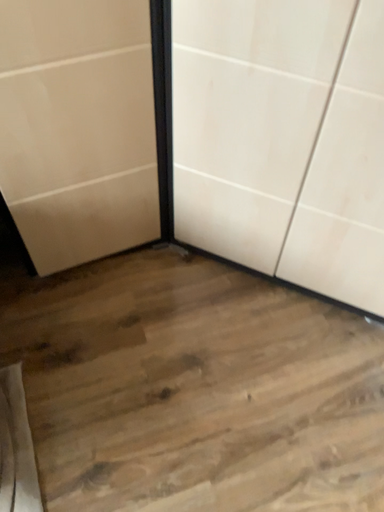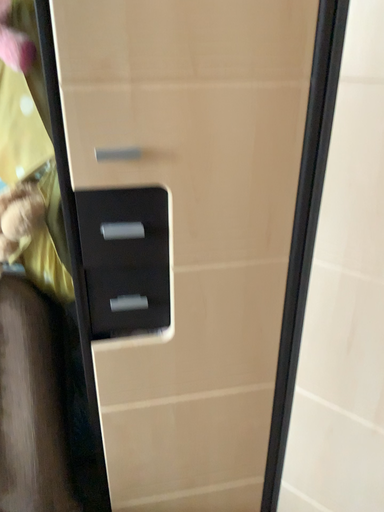
Question: How did the camera likely rotate when shooting the video?

Choices:
 (A) rotated left
 (B) rotated right

Answer: (A)